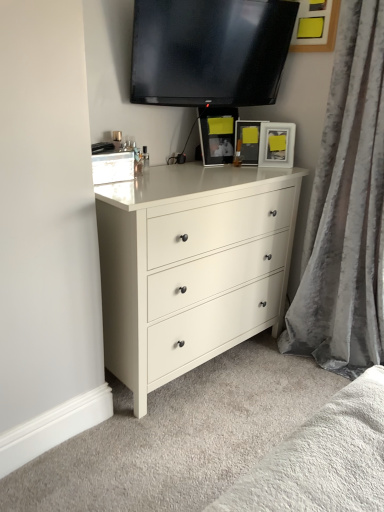
Where is `blank space to the left of matte black picture frame at upper right, marked as the 3th picture frame in a left-to-right arrangement`? Image resolution: width=384 pixels, height=512 pixels. blank space to the left of matte black picture frame at upper right, marked as the 3th picture frame in a left-to-right arrangement is located at coordinates (241, 166).